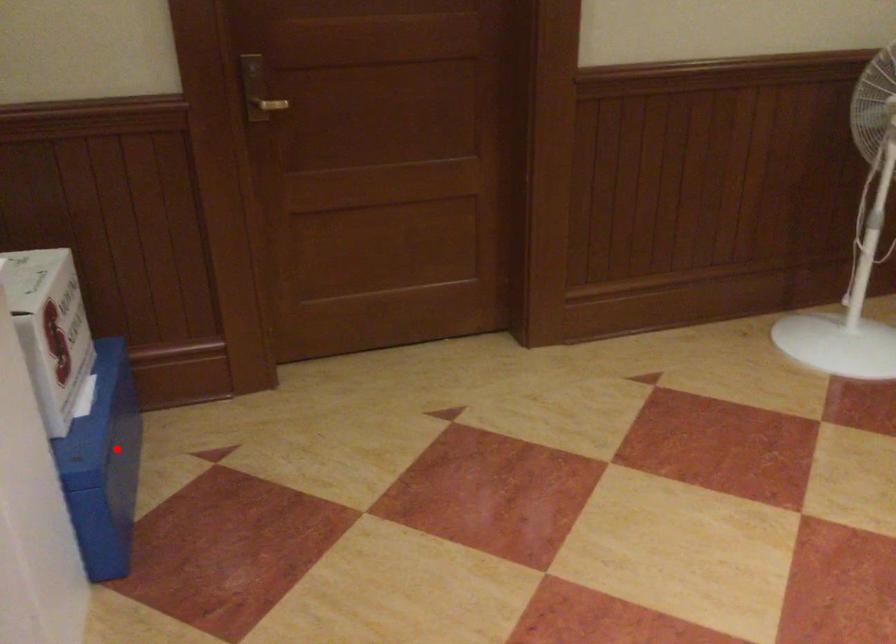
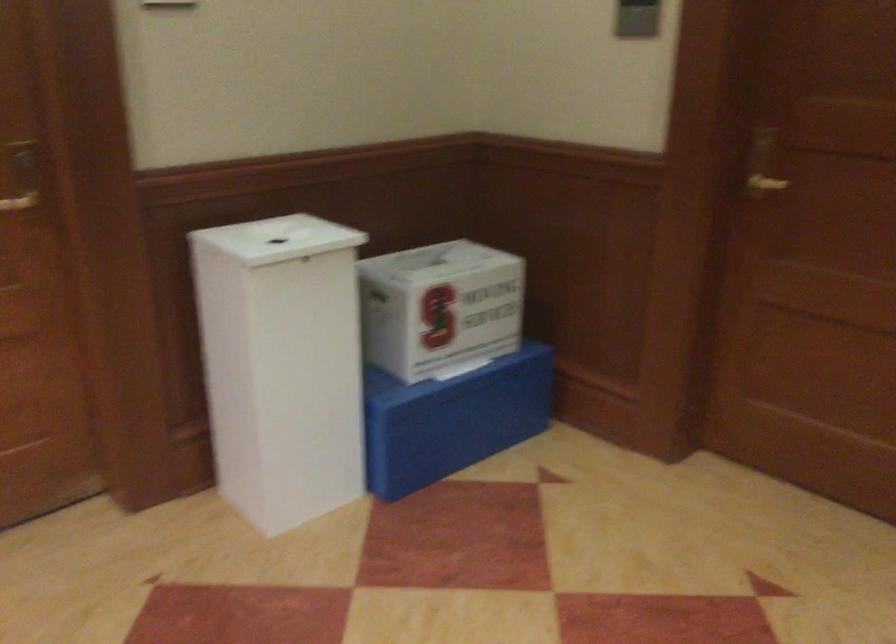
Question: I am providing you with two images of the same scene from different viewpoints. Given a red point in image1, look at the same physical point in image2. Is it:

Choices:
 (A) Closer to the viewpoint
 (B) Farther from the viewpoint

Answer: (B)